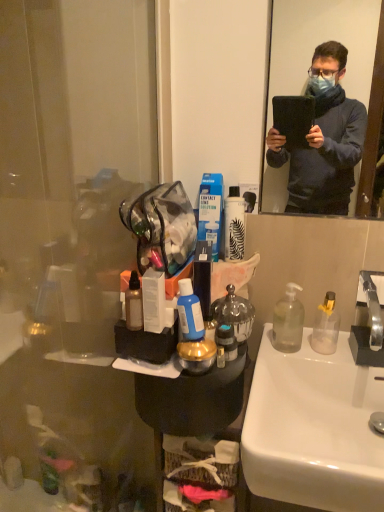
Question: Does metallic silver spray can at center, the 3th toiletries from the right, have a lesser height compared to transparent plastic glass door at left?

Choices:
 (A) yes
 (B) no

Answer: (A)

Question: Can you confirm if metallic silver spray can at center, the 3th toiletries from the right, is bigger than transparent plastic glass door at left?

Choices:
 (A) no
 (B) yes

Answer: (A)

Question: Can you confirm if metallic silver spray can at center, the 3th toiletries from the right, is thinner than transparent plastic glass door at left?

Choices:
 (A) no
 (B) yes

Answer: (B)

Question: From a real-world perspective, is metallic silver spray can at center, which is the first toiletries from left to right, below transparent plastic glass door at left?

Choices:
 (A) yes
 (B) no

Answer: (B)

Question: Considering the relative positions of metallic silver spray can at center, which is the first toiletries from left to right, and transparent plastic glass door at left in the image provided, is metallic silver spray can at center, which is the first toiletries from left to right, to the right of transparent plastic glass door at left from the viewer's perspective?

Choices:
 (A) yes
 (B) no

Answer: (A)

Question: Is the position of metallic silver spray can at center, which is the first toiletries from left to right, more distant than that of transparent plastic glass door at left?

Choices:
 (A) yes
 (B) no

Answer: (A)

Question: Can we say transparent plastic glass door at left lies outside translucent plastic bottle at center, the 3th toiletries from the left?

Choices:
 (A) yes
 (B) no

Answer: (A)

Question: Considering the relative sizes of transparent plastic glass door at left and translucent plastic bottle at center, which is the first toiletries from right to left, in the image provided, is transparent plastic glass door at left smaller than translucent plastic bottle at center, which is the first toiletries from right to left,?

Choices:
 (A) no
 (B) yes

Answer: (A)

Question: Is transparent plastic glass door at left next to translucent plastic bottle at center, which is the first toiletries from right to left, and touching it?

Choices:
 (A) yes
 (B) no

Answer: (B)

Question: From a real-world perspective, is transparent plastic glass door at left on translucent plastic bottle at center, the 3th toiletries from the left?

Choices:
 (A) yes
 (B) no

Answer: (B)

Question: Could translucent plastic bottle at center, the 3th toiletries from the left, be considered to be inside transparent plastic glass door at left?

Choices:
 (A) no
 (B) yes

Answer: (A)

Question: From the image's perspective, would you say transparent plastic glass door at left is positioned over translucent plastic bottle at center, the 3th toiletries from the left?

Choices:
 (A) no
 (B) yes

Answer: (A)

Question: Is silver metallic faucet at right wider than translucent plastic bottle at center, which is the first toiletries from right to left?

Choices:
 (A) yes
 (B) no

Answer: (A)